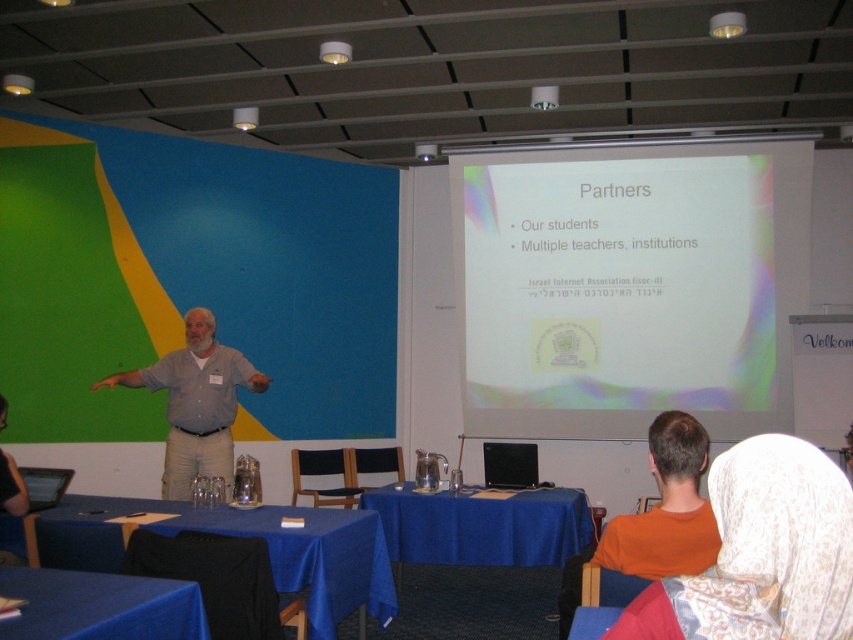
Can you confirm if white lace headscarf at upper right is taller than orange cotton shirt at lower right?

No.

Which is behind, point (782, 611) or point (657, 516)?

Positioned behind is point (657, 516).

Between point (828, 628) and point (669, 433), which one is positioned behind?

Positioned behind is point (669, 433).

Find the location of a particular element. white lace headscarf at upper right is located at coordinates click(x=762, y=554).

Consider the image. Who is higher up, white lace headscarf at upper right or blue fabric table at lower left?

white lace headscarf at upper right is above.

From the picture: Between white lace headscarf at upper right and blue fabric table at lower left, which one is positioned lower?

blue fabric table at lower left is below.

You are a GUI agent. You are given a task and a screenshot of the screen. Output one action in this format:
    pyautogui.click(x=<x>, y=<y>)
    Task: Click on the white lace headscarf at upper right
    
    Given the screenshot: What is the action you would take?
    pyautogui.click(x=762, y=554)

Can you confirm if white matte projector screen at upper center is wider than gray cotton shirt at center?

Yes, white matte projector screen at upper center is wider than gray cotton shirt at center.

Does point (704, 177) come farther from viewer compared to point (196, 369)?

Yes, point (704, 177) is behind point (196, 369).

Image resolution: width=853 pixels, height=640 pixels. Find the location of `white matte projector screen at upper center`. white matte projector screen at upper center is located at coordinates (616, 292).